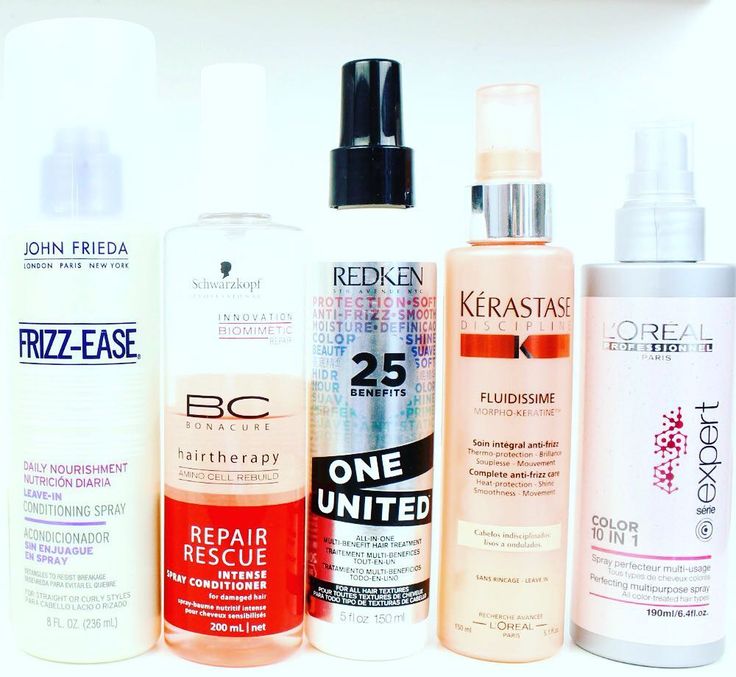
In order to click on bottle in this screenshot , I will do `click(96, 441)`, `click(251, 483)`, `click(386, 472)`, `click(513, 464)`, `click(637, 452)`.